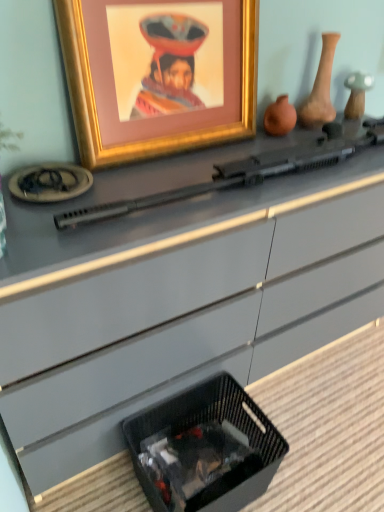
You are a GUI agent. You are given a task and a screenshot of the screen. Output one action in this format:
    pyautogui.click(x=<x>, y=<y>)
    Task: Click on the vacant space that's between matte clay vase at upper right, placed as the second vase when sorted from left to right, and black plastic rifle at center
    This screenshot has height=512, width=384.
    Given the screenshot: What is the action you would take?
    pyautogui.click(x=248, y=150)